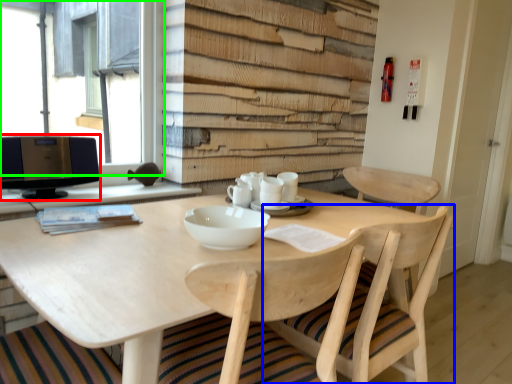
Question: Which is nearer to the computer monitor (highlighted by a red box)? chair (highlighted by a blue box) or window (highlighted by a green box).

Choices:
 (A) chair
 (B) window

Answer: (B)